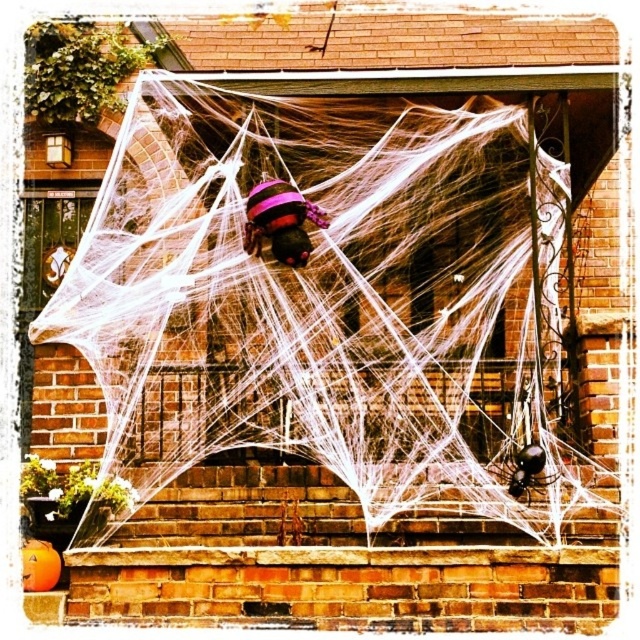
You are a child trying to find the bigger decoration between the white mesh spider web at center and the purple fuzzy spider at center on the Halloween porch. Which one should you choose?

The white mesh spider web at center is larger in size compared to the purple fuzzy spider at center, so you should choose the white mesh spider web at center.

You are a child trying to find the spiders on the Halloween porch decoration. You notice two spiders, the purple fuzzy spider at center and the black glossy spider at lower right. Which spider is located higher up?

The purple fuzzy spider at center is above the black glossy spider at lower right, so the purple fuzzy spider at center is located higher up.